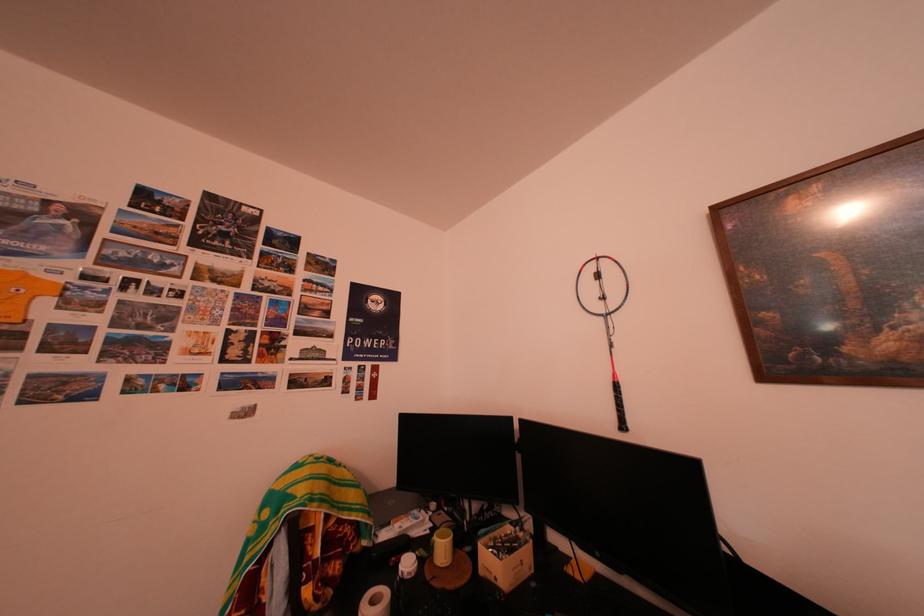
Where is `small cardboard box`? This screenshot has height=616, width=924. small cardboard box is located at coordinates click(505, 557).